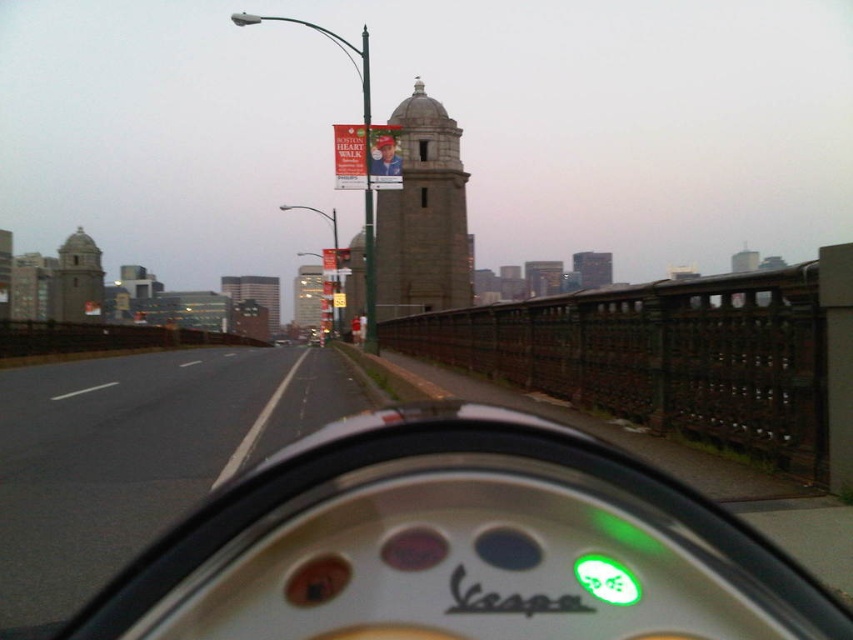
Question: Which of the following is the closest to the observer?

Choices:
 (A) gray stone tower at center
 (B) white matte vespa at center
 (C) brick tower at center
 (D) black asphalt highway at center

Answer: (B)

Question: Can you confirm if white matte vespa at center is wider than gray stone tower at center?

Choices:
 (A) yes
 (B) no

Answer: (B)

Question: Among these objects, which one is farthest from the camera?

Choices:
 (A) gray stone tower at left
 (B) gray stone tower at center
 (C) brick tower at center

Answer: (C)

Question: Is white matte vespa at center thinner than black asphalt highway at center?

Choices:
 (A) no
 (B) yes

Answer: (B)

Question: Which point is closer to the camera?

Choices:
 (A) (20, 476)
 (B) (328, 461)
 (C) (86, 291)
 (D) (271, 284)

Answer: (B)

Question: Does black asphalt highway at center appear under gray stone tower at left?

Choices:
 (A) yes
 (B) no

Answer: (A)